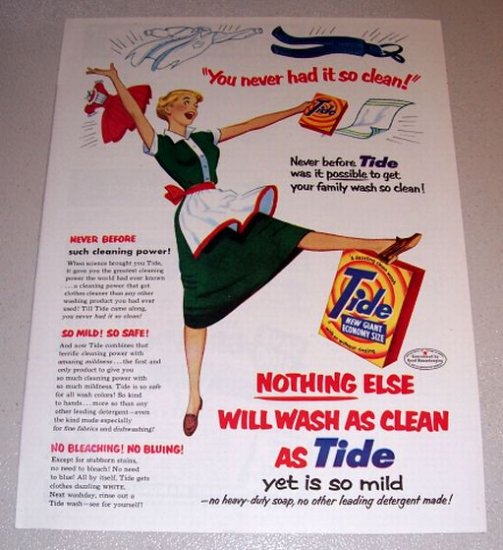
What are the coordinates of `background white wall` in the screenshot? It's located at (483, 70).